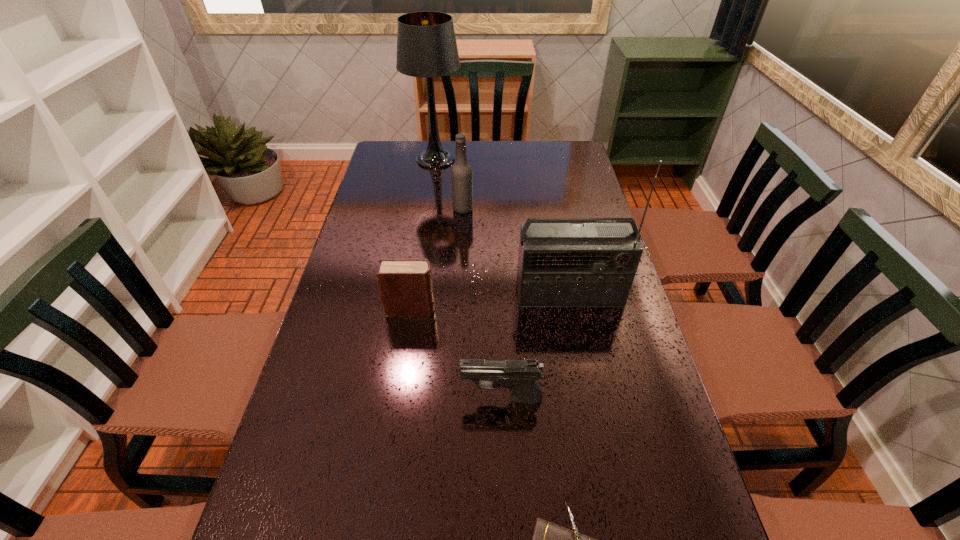
You are a GUI agent. You are given a task and a screenshot of the screen. Output one action in this format:
    pyautogui.click(x=<x>, y=<y>)
    Task: Click on the farthest object
    The width and height of the screenshot is (960, 540).
    Given the screenshot: What is the action you would take?
    pyautogui.click(x=426, y=44)

The height and width of the screenshot is (540, 960). I want to click on the fifth shortest object, so click(x=593, y=264).

You are a GUI agent. You are given a task and a screenshot of the screen. Output one action in this format:
    pyautogui.click(x=<x>, y=<y>)
    Task: Click on the beer bottle
    The image size is (960, 540).
    Given the screenshot: What is the action you would take?
    pyautogui.click(x=461, y=173)

The image size is (960, 540). I want to click on the fifth nearest object, so click(461, 173).

At what (x,y) coordinates should I click in order to perform the action: click on the taller diary. Please return your answer as a coordinate pair (x, y). The height and width of the screenshot is (540, 960). Looking at the image, I should click on (405, 285).

This screenshot has width=960, height=540. I want to click on the farther diary, so tap(405, 285).

At what (x,y) coordinates should I click in order to perform the action: click on the fifth farthest object. Please return your answer as a coordinate pair (x, y). The width and height of the screenshot is (960, 540). Looking at the image, I should click on (520, 376).

Where is `the second shortest object`? This screenshot has width=960, height=540. the second shortest object is located at coordinates (520, 376).

Find the location of a particular element. This screenshot has height=540, width=960. vacant area located 0.240m on the front of the farthest object is located at coordinates (428, 213).

This screenshot has height=540, width=960. I want to click on free space located on the front panel of the radio receiver, so click(581, 353).